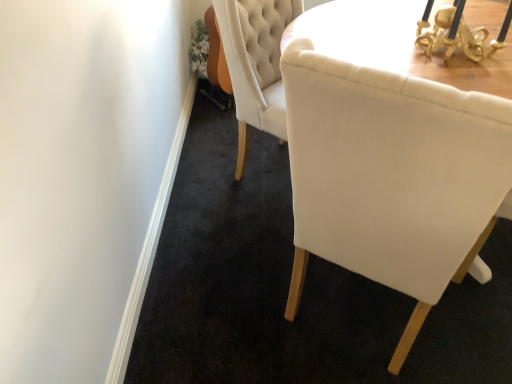
Question: Does matte white chair at center appear on the right side of gold metallic table lamp at upper right?

Choices:
 (A) no
 (B) yes

Answer: (A)

Question: Does matte white chair at center have a lesser width compared to gold metallic table lamp at upper right?

Choices:
 (A) no
 (B) yes

Answer: (A)

Question: Can you see matte white chair at center touching gold metallic table lamp at upper right?

Choices:
 (A) no
 (B) yes

Answer: (A)

Question: Is matte white chair at center to the left of gold metallic table lamp at upper right from the viewer's perspective?

Choices:
 (A) no
 (B) yes

Answer: (B)

Question: Is matte white chair at center not inside gold metallic table lamp at upper right?

Choices:
 (A) no
 (B) yes

Answer: (B)

Question: Is matte white chair at center turned away from gold metallic table lamp at upper right?

Choices:
 (A) no
 (B) yes

Answer: (A)

Question: Is gold metallic table lamp at upper right smaller than matte white chair at center?

Choices:
 (A) yes
 (B) no

Answer: (A)

Question: From a real-world perspective, is gold metallic table lamp at upper right located higher than matte white chair at center?

Choices:
 (A) no
 (B) yes

Answer: (B)

Question: Is gold metallic table lamp at upper right further to camera compared to matte white chair at center?

Choices:
 (A) no
 (B) yes

Answer: (B)

Question: Is gold metallic table lamp at upper right at the left side of matte white chair at center?

Choices:
 (A) yes
 (B) no

Answer: (B)

Question: Can you confirm if gold metallic table lamp at upper right is thinner than matte white chair at center?

Choices:
 (A) yes
 (B) no

Answer: (A)

Question: Is matte white chair at center at the back of gold metallic table lamp at upper right?

Choices:
 (A) no
 (B) yes

Answer: (A)

Question: Considering the positions of gold metallic table lamp at upper right and matte white chair at center in the image, is gold metallic table lamp at upper right taller or shorter than matte white chair at center?

Choices:
 (A) short
 (B) tall

Answer: (A)